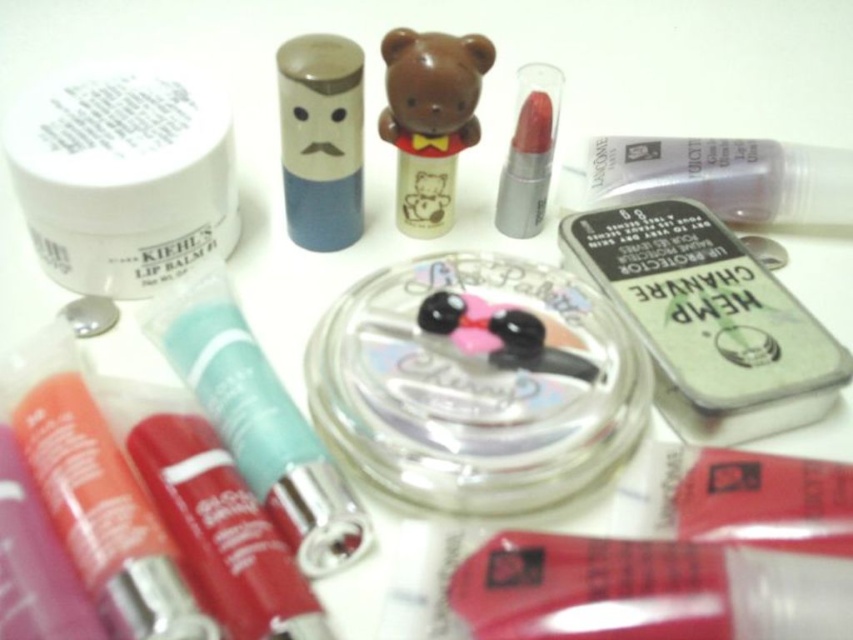
You are organizing a beauty counter and need to place a new product between the clear plastic container at center and the shiny plastic lip balm at lower left. Based on their positions, where should you place the new product?

The clear plastic container at center is to the right of the shiny plastic lip balm at lower left, so the new product should be placed between them, to the right of the shiny plastic lip balm at lower left and to the left of the clear plastic container at center.

You are organizing beauty products on a shelf and need to place the clear plastic container at center and the shiny plastic lip balm at lower left. Based on their positions in the image, which one should you place higher on the shelf to maintain the same arrangement?

The clear plastic container at center is located above the shiny plastic lip balm at lower left in the image, so to maintain the same arrangement, you should place the clear plastic container at center higher on the shelf than the shiny plastic lip balm at lower left.